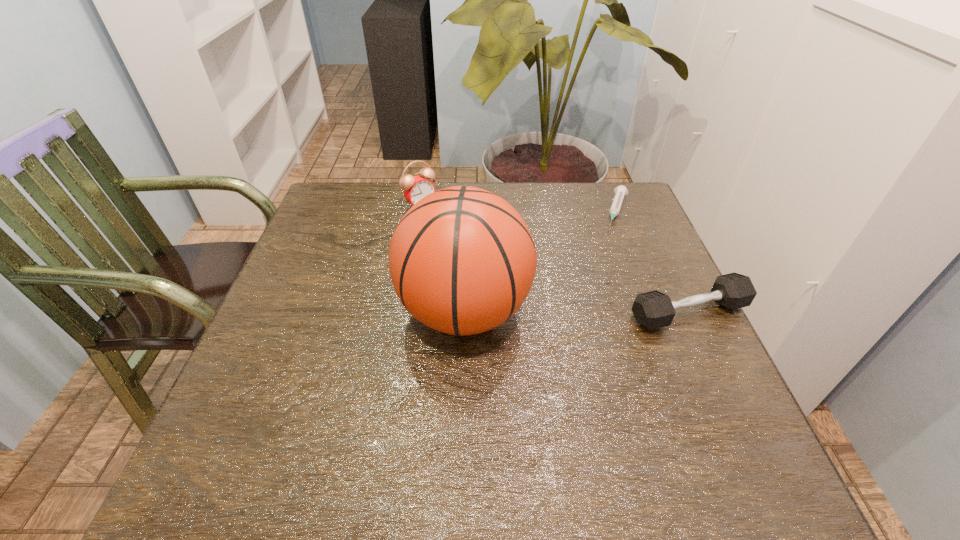
This screenshot has height=540, width=960. I want to click on vacant position located 0.080m on the clock face of the alarm clock, so click(445, 225).

Identify the location of vacant region located 0.160m on the clock face of the alarm clock. (463, 239).

Identify the location of syringe located at the far edge. (620, 191).

Identify the location of alarm clock that is at the far edge. (415, 188).

The width and height of the screenshot is (960, 540). Identify the location of dumbbell present at the right edge. (654, 309).

Find the location of a particular element. This screenshot has width=960, height=540. syringe that is at the right edge is located at coordinates (620, 191).

Locate an element on the screen. The image size is (960, 540). object present at the far right corner is located at coordinates (620, 191).

The image size is (960, 540). Find the location of `free space at the far edge`. free space at the far edge is located at coordinates (482, 183).

Identify the location of vacant space at the near edge. (344, 423).

I want to click on free location at the left edge, so click(326, 292).